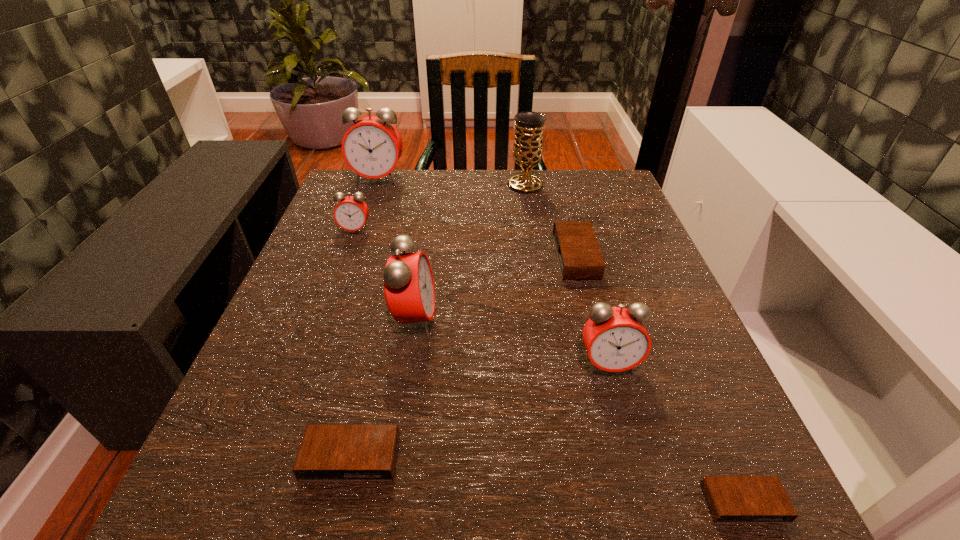
The width and height of the screenshot is (960, 540). In order to click on the biggest black alarm clock in this screenshot , I will do `click(579, 256)`.

At what (x,y) coordinates should I click in order to perform the action: click on the second shortest object. Please return your answer as a coordinate pair (x, y). This screenshot has height=540, width=960. Looking at the image, I should click on (327, 452).

You are a GUI agent. You are given a task and a screenshot of the screen. Output one action in this format:
    pyautogui.click(x=<x>, y=<y>)
    Task: Click on the second smallest black alarm clock
    The width and height of the screenshot is (960, 540).
    Given the screenshot: What is the action you would take?
    pyautogui.click(x=327, y=452)

I want to click on the rightmost object, so click(x=731, y=499).

Identify the location of the shortest alarm clock. Image resolution: width=960 pixels, height=540 pixels. (731, 499).

The height and width of the screenshot is (540, 960). Find the location of `vacant space located on the front-facing side of the farthest alarm clock`. vacant space located on the front-facing side of the farthest alarm clock is located at coordinates (356, 245).

Locate an element on the screen. This screenshot has height=540, width=960. vacant space situated 0.170m on the left of the chalice is located at coordinates (440, 185).

This screenshot has height=540, width=960. What are the coordinates of `free space located 0.290m on the front-facing side of the fourth farthest alarm clock` in the screenshot? It's located at (605, 320).

You are a GUI agent. You are given a task and a screenshot of the screen. Output one action in this format:
    pyautogui.click(x=<x>, y=<y>)
    Task: Click on the free space located on the front-facing side of the rightmost red alarm clock
    This screenshot has height=540, width=960.
    Given the screenshot: What is the action you would take?
    pyautogui.click(x=622, y=415)

This screenshot has width=960, height=540. I want to click on vacant position located on the front-facing side of the fourth tallest alarm clock, so click(298, 386).